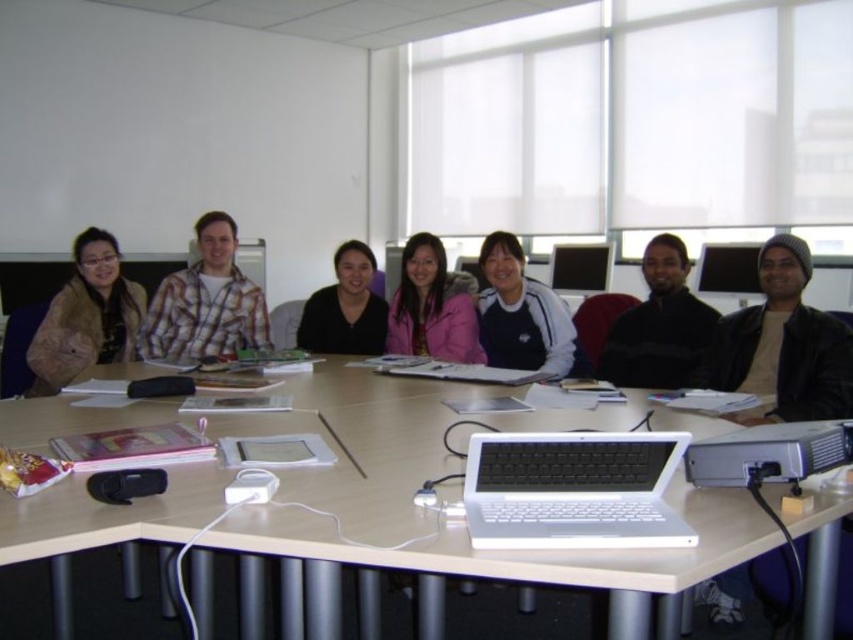
Question: Where is white plastic table at center located in relation to black matte shirt at center in the image?

Choices:
 (A) below
 (B) above

Answer: (A)

Question: Which point appears farthest from the camera in this image?

Choices:
 (A) (709, 378)
 (B) (352, 314)
 (C) (67, 307)

Answer: (B)

Question: Can you confirm if matte brown jacket at left is positioned below white fleece jacket at center?

Choices:
 (A) yes
 (B) no

Answer: (A)

Question: Does black matte jacket at center appear over silver metallic projector at lower right?

Choices:
 (A) no
 (B) yes

Answer: (B)

Question: Among these objects, which one is farthest from the camera?

Choices:
 (A) matte brown jacket at left
 (B) white matte laptop at center

Answer: (A)

Question: Which is nearer to the matte brown jacket at left?

Choices:
 (A) silver metallic projector at lower right
 (B) black leather jacket at right

Answer: (B)